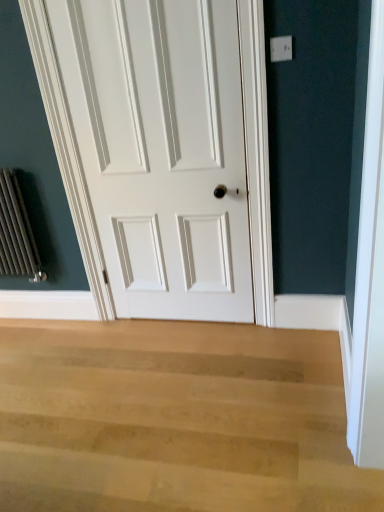
Find the location of a particular element. light wood floor at lower center is located at coordinates (175, 419).

What is the approximate height of light wood floor at lower center?

7.80 centimeters.

Describe the element at coordinates (175, 419) in the screenshot. I see `light wood floor at lower center` at that location.

Locate an element on the screen. This screenshot has height=512, width=384. white painted wood door at center is located at coordinates (162, 150).

The height and width of the screenshot is (512, 384). What do you see at coordinates (162, 150) in the screenshot?
I see `white painted wood door at center` at bounding box center [162, 150].

Measure the distance between point (212, 72) and camera.

1.86 meters.

This screenshot has width=384, height=512. Find the location of `light wood floor at lower center`. light wood floor at lower center is located at coordinates (175, 419).

Which object is positioned more to the left, white painted wood door at center or light wood floor at lower center?

light wood floor at lower center is more to the left.

Considering their positions, is white painted wood door at center located in front of or behind light wood floor at lower center?

In the image, white painted wood door at center appears behind light wood floor at lower center.

Between point (117, 282) and point (216, 344), which one is positioned behind?

The point (117, 282) is more distant.

From the image's perspective, between white painted wood door at center and light wood floor at lower center, who is located below?

From the image's view, light wood floor at lower center is below.

From a real-world perspective, between white painted wood door at center and light wood floor at lower center, who is vertically higher?

From a 3D spatial view, white painted wood door at center is above.

Which object is thinner, white painted wood door at center or light wood floor at lower center?

Thinner between the two is white painted wood door at center.

Considering the sizes of objects white painted wood door at center and light wood floor at lower center in the image provided, who is taller, white painted wood door at center or light wood floor at lower center?

white painted wood door at center is taller.

Which of these two, white painted wood door at center or light wood floor at lower center, is bigger?

light wood floor at lower center is bigger.

Is light wood floor at lower center surrounded by white painted wood door at center?

Actually, light wood floor at lower center is outside white painted wood door at center.

Is white painted wood door at center next to light wood floor at lower center and touching it?

No, white painted wood door at center is not beside light wood floor at lower center.

Is white painted wood door at center positioned with its back to light wood floor at lower center?

white painted wood door at center is not turned away from light wood floor at lower center.

What are the coordinates of `stairwell below the white painted wood door at center (from a real-world perspective)` in the screenshot? It's located at (175, 419).

Considering the relative positions of light wood floor at lower center and white painted wood door at center in the image provided, is light wood floor at lower center to the left or to the right of white painted wood door at center?

light wood floor at lower center is positioned on white painted wood door at center's left side.

Is light wood floor at lower center positioned in front of white painted wood door at center?

Yes, light wood floor at lower center is closer to the camera.

Considering the points (128, 478) and (85, 91), which point is in front, point (128, 478) or point (85, 91)?

The point (128, 478) is in front.

From the image's perspective, would you say light wood floor at lower center is shown under white painted wood door at center?

Indeed, from the image's perspective, light wood floor at lower center is shown beneath white painted wood door at center.

From a real-world perspective, is light wood floor at lower center beneath white painted wood door at center?

Correct, in the physical world, light wood floor at lower center is lower than white painted wood door at center.

Is light wood floor at lower center wider or thinner than white painted wood door at center?

Considering their sizes, light wood floor at lower center looks broader than white painted wood door at center.

Which of these two, light wood floor at lower center or white painted wood door at center, stands shorter?

With less height is light wood floor at lower center.

Which of these two, light wood floor at lower center or white painted wood door at center, is smaller?

With smaller size is white painted wood door at center.

Is light wood floor at lower center not inside white painted wood door at center?

light wood floor at lower center lies outside white painted wood door at center's area.

Would you consider light wood floor at lower center to be distant from white painted wood door at center?

That's not correct — light wood floor at lower center is a little close to white painted wood door at center.

Is light wood floor at lower center facing towards white painted wood door at center?

No, light wood floor at lower center does not turn towards white painted wood door at center.

How distant is light wood floor at lower center from white painted wood door at center?

A: light wood floor at lower center and white painted wood door at center are 34.14 inches apart.

This screenshot has height=512, width=384. I want to click on door above the light wood floor at lower center (from the image's perspective), so click(x=162, y=150).

In order to click on door that appears behind the light wood floor at lower center in this screenshot , I will do `click(162, 150)`.

Image resolution: width=384 pixels, height=512 pixels. I want to click on stairwell located underneath the white painted wood door at center (from a real-world perspective), so click(x=175, y=419).